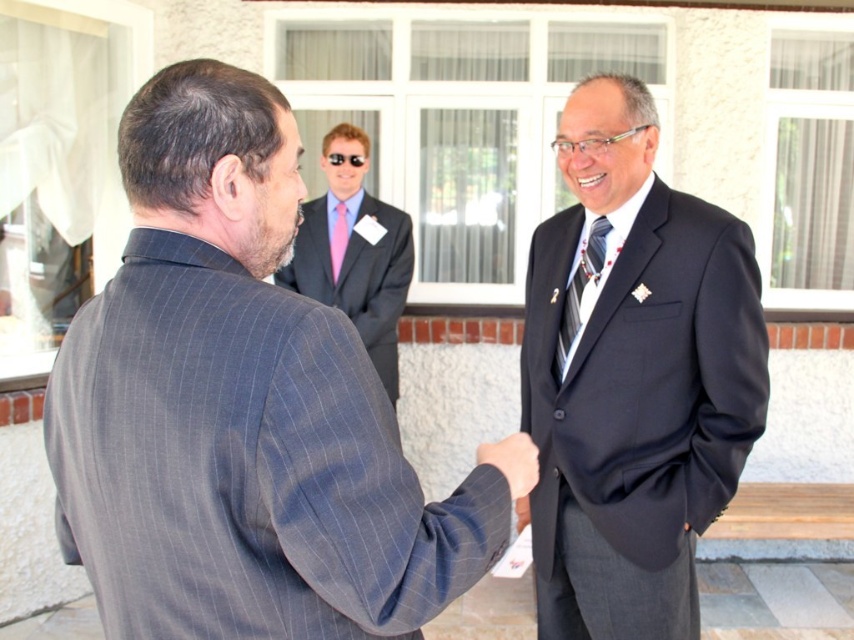
You are standing at the wooden bench partially visible at the bottom right corner of the image. You want to walk to the point labeled as point (290,156). Which direction should you go relative to the point labeled as point (349,294)?

Since point (290,156) is in front of point (349,294), you should walk towards the direction of point (290,156) which is ahead of point (349,294).

You are a photographer at the event and want to capture both the gray pinstripe suit at center and the dark blue suit at center in a single frame. Which suit will appear shorter in the photo?

The gray pinstripe suit at center will appear shorter in the photo because it is not as tall as the dark blue suit at center.